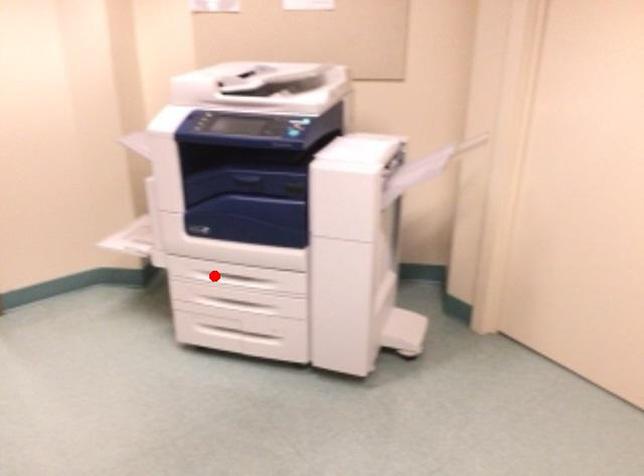
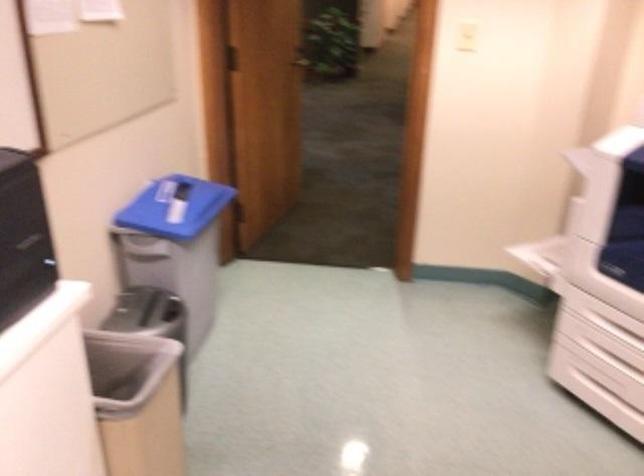
Question: I am providing you with two images of the same scene from different viewpoints. In image1, a red point is highlighted. Considering the same 3D point in image2, which of the following is correct?

Choices:
 (A) It is closer
 (B) It is farther

Answer: (A)